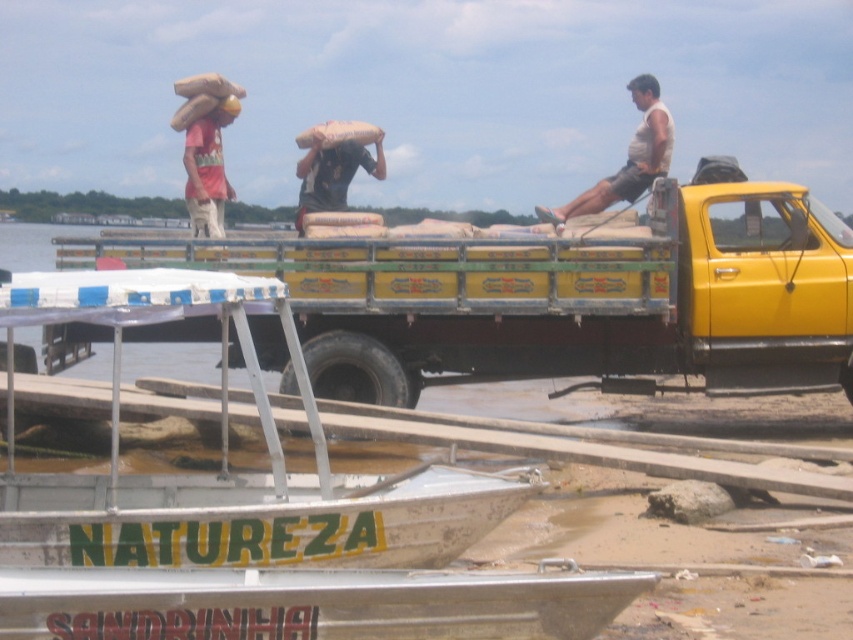
You are standing at the point marked by the coordinates point (207, 170) in the image. What is the nearest object to you?

The nearest object to you at point (207, 170) is the matte red t shirt at upper left.

You are standing on the sandy shore and want to place a new item between the white plastic boat at lower left and the white cotton shirt at upper right. Based on their positions, where should you place the item?

The white plastic boat at lower left is positioned under the white cotton shirt at upper right, so you should place the new item between them either horizontally or vertically depending on the space available.